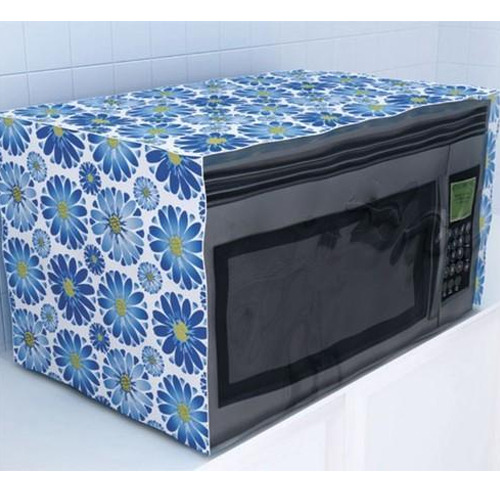
This screenshot has width=500, height=500. I want to click on keypad, so click(x=453, y=235), click(x=457, y=271).